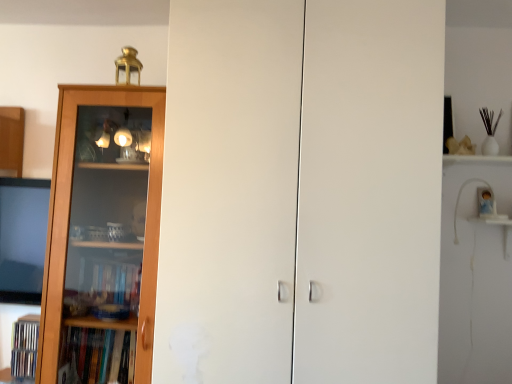
Question: Would you consider white matte cabinet doors at center to be distant from wooden bookcase at left?

Choices:
 (A) yes
 (B) no

Answer: (B)

Question: From the image's perspective, is white matte cabinet doors at center located beneath wooden bookcase at left?

Choices:
 (A) yes
 (B) no

Answer: (B)

Question: From a real-world perspective, is white matte cabinet doors at center located higher than wooden bookcase at left?

Choices:
 (A) no
 (B) yes

Answer: (B)

Question: Are white matte cabinet doors at center and wooden bookcase at left making contact?

Choices:
 (A) no
 (B) yes

Answer: (A)

Question: From the image's perspective, would you say white matte cabinet doors at center is positioned over wooden bookcase at left?

Choices:
 (A) no
 (B) yes

Answer: (B)

Question: Is wooden bookcase at left at the back of white matte cabinet doors at center?

Choices:
 (A) yes
 (B) no

Answer: (B)

Question: From the image's perspective, is wooden bookcase at left below white matte cabinet doors at center?

Choices:
 (A) yes
 (B) no

Answer: (A)

Question: Does wooden bookcase at left lie behind white matte cabinet doors at center?

Choices:
 (A) yes
 (B) no

Answer: (A)

Question: Does wooden bookcase at left turn towards white matte cabinet doors at center?

Choices:
 (A) no
 (B) yes

Answer: (A)

Question: Is wooden bookcase at left next to white matte cabinet doors at center and touching it?

Choices:
 (A) no
 (B) yes

Answer: (A)

Question: Is white matte cabinet doors at center completely or partially inside wooden bookcase at left?

Choices:
 (A) no
 (B) yes

Answer: (A)

Question: From a real-world perspective, is wooden bookcase at left on top of white matte cabinet doors at center?

Choices:
 (A) no
 (B) yes

Answer: (A)

Question: Is white matte cabinet doors at center in front of or behind wooden bookcase at left in the image?

Choices:
 (A) front
 (B) behind

Answer: (A)